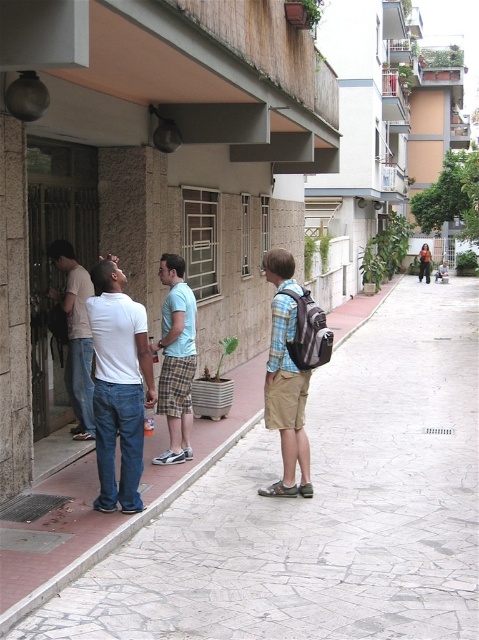
Question: From the image, what is the correct spatial relationship of gray stone pavement at lower left in relation to light blue plaid shorts at center?

Choices:
 (A) right
 (B) left

Answer: (A)

Question: Which object is positioned closest to the white matte shirt at center?

Choices:
 (A) light blue plaid shorts at center
 (B) matte white shirt at left

Answer: (A)

Question: Does plaid shirt backpack at center have a greater width compared to matte white shirt at left?

Choices:
 (A) yes
 (B) no

Answer: (A)

Question: Is white matte shirt at center to the right of light blue plaid shorts at center from the viewer's perspective?

Choices:
 (A) yes
 (B) no

Answer: (B)

Question: Which point appears farthest from the camera in this image?

Choices:
 (A) (70, 374)
 (B) (187, 304)

Answer: (A)

Question: Among these objects, which one is farthest from the camera?

Choices:
 (A) matte white shirt at left
 (B) gray stone pavement at lower left
 (C) light blue plaid shorts at center
 (D) white matte shirt at center

Answer: (A)